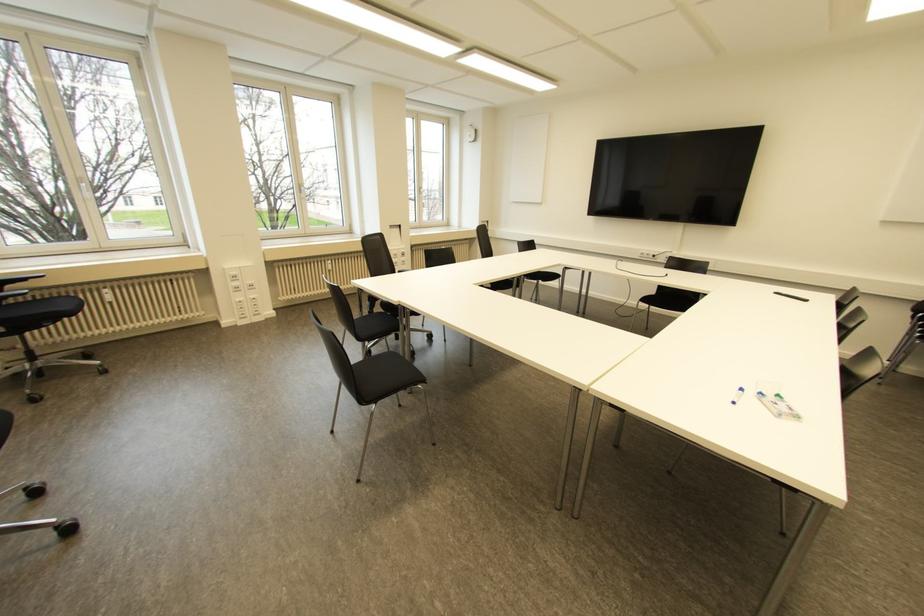
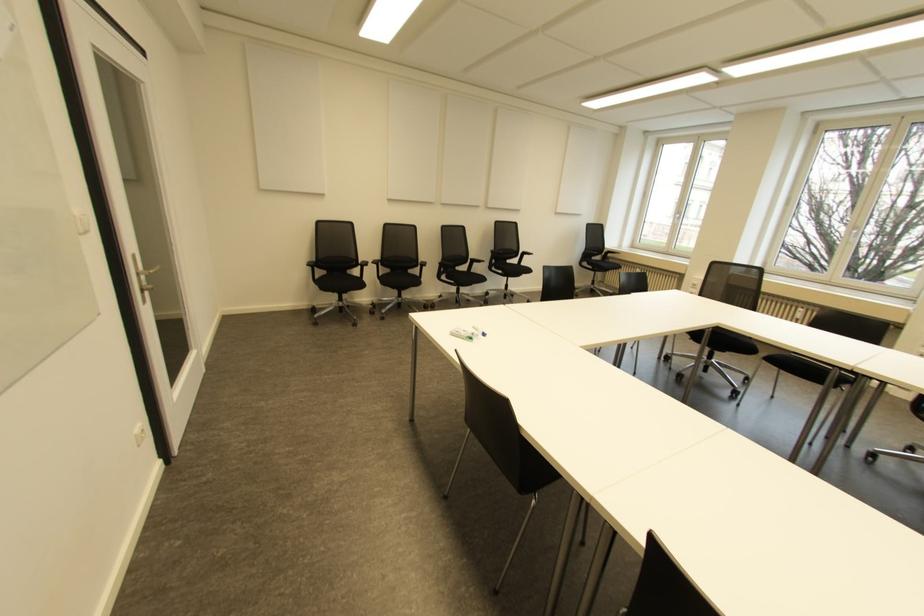
Locate, in the second image, the point that corresponds to (777,395) in the first image.

(470, 338)